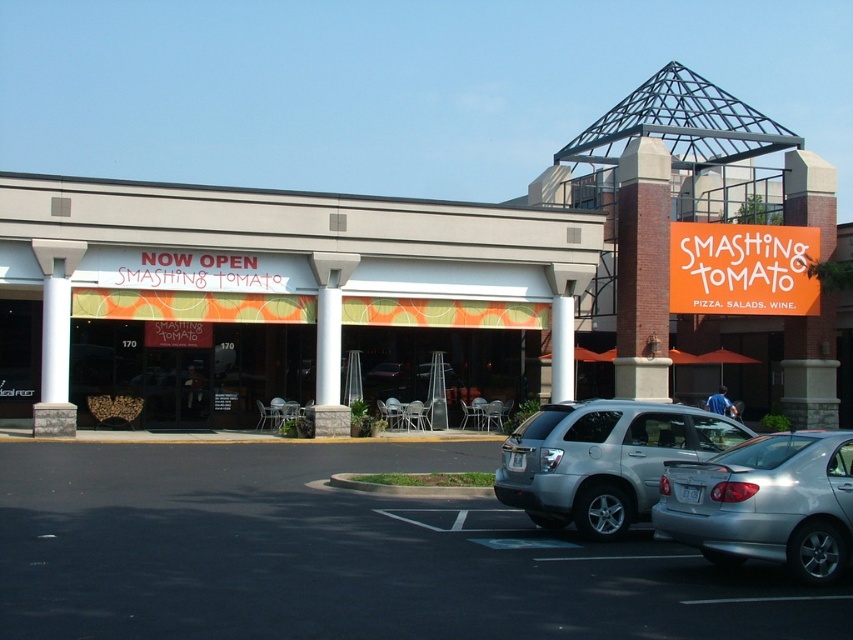
You are a customer arriving at the Smashing Tomato restaurant. You see the black asphalt parking lot at lower left and the silver metallic suv at lower right. Which object is positioned higher up in the image?

The black asphalt parking lot at lower left is positioned higher up in the image than the silver metallic suv at lower right because it is much taller as silver metallic suv at lower right.

You are a delivery driver with a 2.2 meter wide truck. You need to park your truck between the silver metallic sedan at lower right and the silver metallic suv at lower right. Is there enough space for your truck to fit between them?

The distance between the silver metallic sedan at lower right and the silver metallic suv at lower right is 2.42 meters. Since your truck is 2.2 meters wide, there is enough space for your truck to fit between them as 2.42 meters is greater than 2.2 meters.